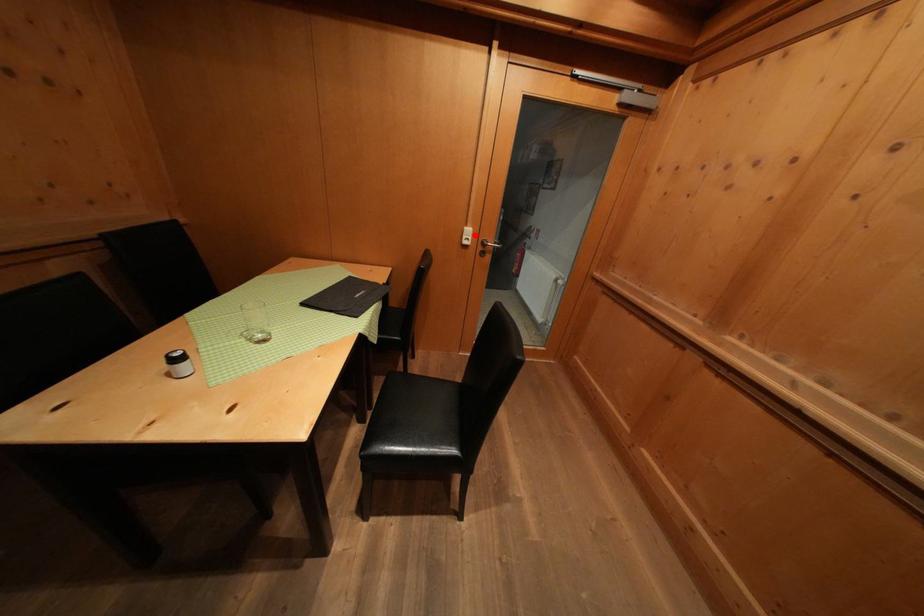
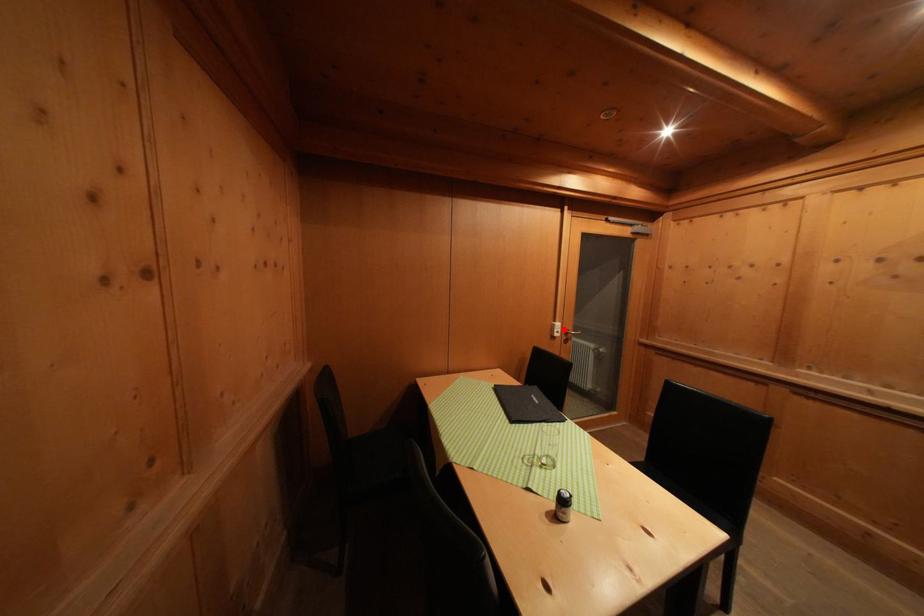
I am providing you with two images of the same scene from different viewpoints. A red point is marked on the first image and another point is marked on the second image. Do the highlighted points in image1 and image2 indicate the same real-world spot?

Yes